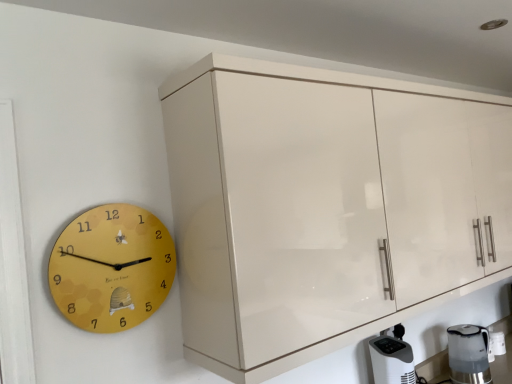
Question: From the image's perspective, is glossy cream cabinet at upper right under yellow matte clock at left?

Choices:
 (A) no
 (B) yes

Answer: (A)

Question: Can you confirm if glossy cream cabinet at upper right is bigger than yellow matte clock at left?

Choices:
 (A) yes
 (B) no

Answer: (A)

Question: Is glossy cream cabinet at upper right taller than yellow matte clock at left?

Choices:
 (A) no
 (B) yes

Answer: (B)

Question: Considering the relative positions of glossy cream cabinet at upper right and yellow matte clock at left in the image provided, is glossy cream cabinet at upper right to the right of yellow matte clock at left from the viewer's perspective?

Choices:
 (A) no
 (B) yes

Answer: (B)

Question: Is glossy cream cabinet at upper right wider than yellow matte clock at left?

Choices:
 (A) yes
 (B) no

Answer: (A)

Question: Considering the relative sizes of glossy cream cabinet at upper right and yellow matte clock at left in the image provided, is glossy cream cabinet at upper right shorter than yellow matte clock at left?

Choices:
 (A) no
 (B) yes

Answer: (A)

Question: From the image's perspective, is satin silver kettle at lower right under white plastic air purifier at lower right?

Choices:
 (A) no
 (B) yes

Answer: (A)

Question: Are satin silver kettle at lower right and white plastic air purifier at lower right located far from each other?

Choices:
 (A) yes
 (B) no

Answer: (B)

Question: Is satin silver kettle at lower right to the right of white plastic air purifier at lower right from the viewer's perspective?

Choices:
 (A) no
 (B) yes

Answer: (B)

Question: Is satin silver kettle at lower right touching white plastic air purifier at lower right?

Choices:
 (A) no
 (B) yes

Answer: (A)

Question: From the image's perspective, is satin silver kettle at lower right located above white plastic air purifier at lower right?

Choices:
 (A) yes
 (B) no

Answer: (A)

Question: Would you say white plastic air purifier at lower right is part of satin silver kettle at lower right's contents?

Choices:
 (A) no
 (B) yes

Answer: (A)

Question: Considering the relative positions of satin silver kettle at lower right and glossy cream cabinet at upper right in the image provided, is satin silver kettle at lower right behind glossy cream cabinet at upper right?

Choices:
 (A) no
 (B) yes

Answer: (B)